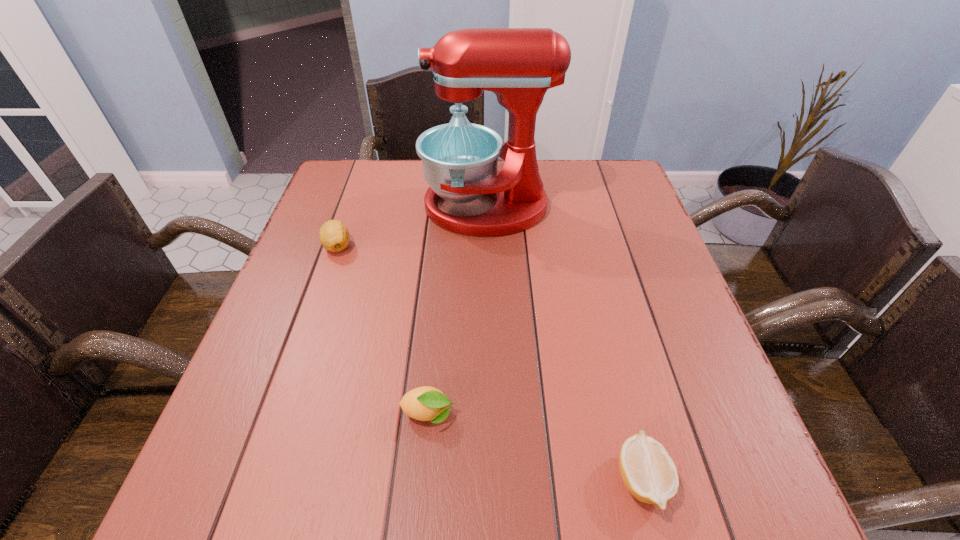
The width and height of the screenshot is (960, 540). What are the coordinates of `vacant position at the left edge of the desktop` in the screenshot? It's located at (316, 309).

Locate an element on the screen. This screenshot has height=540, width=960. vacant region at the right edge of the desktop is located at coordinates (641, 411).

In the image, there is a desktop. At what (x,y) coordinates should I click in order to perform the action: click on vacant region at the far left corner. Please return your answer as a coordinate pair (x, y). Looking at the image, I should click on (332, 171).

Where is `vacant space at the far right corner of the desktop`? Image resolution: width=960 pixels, height=540 pixels. vacant space at the far right corner of the desktop is located at coordinates (612, 163).

Where is `unoccupied area between the leftmost object and the tallest object`? This screenshot has height=540, width=960. unoccupied area between the leftmost object and the tallest object is located at coordinates (412, 226).

Locate an element on the screen. vacant space in between the leftmost object and the mixer is located at coordinates (412, 226).

The height and width of the screenshot is (540, 960). Find the location of `vacant area between the second nearest object and the mixer`. vacant area between the second nearest object and the mixer is located at coordinates (458, 310).

Identify the location of free area in between the nearest object and the second nearest lemon. This screenshot has width=960, height=540. (535, 447).

Locate an element on the screen. The height and width of the screenshot is (540, 960). vacant area between the leftmost object and the third farthest object is located at coordinates (383, 330).

At what (x,y) coordinates should I click in order to perform the action: click on free space between the second farthest lemon and the tallest object. Please return your answer as a coordinate pair (x, y). Looking at the image, I should click on (458, 310).